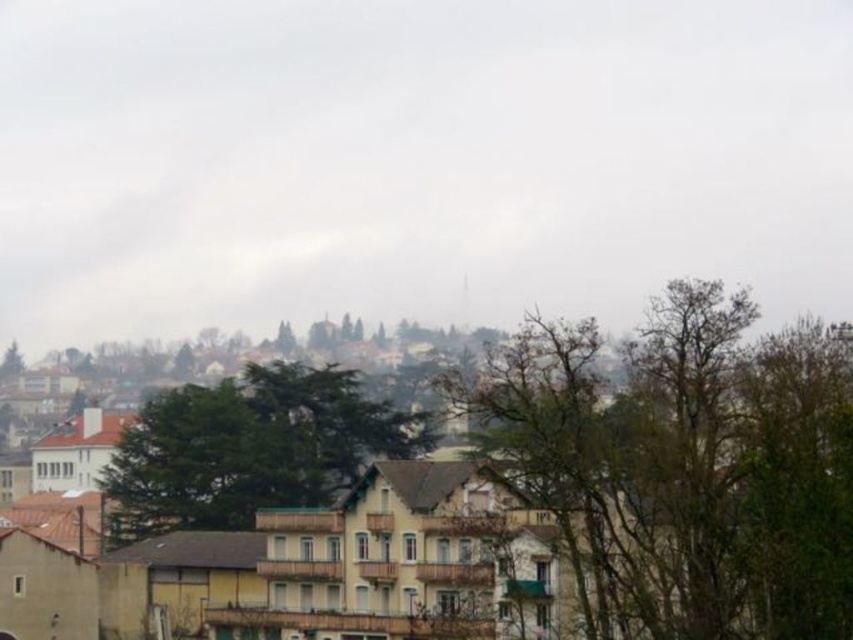
Does yellow matte building at center appear on the left side of brown leafless tree at center?

Indeed, yellow matte building at center is positioned on the left side of brown leafless tree at center.

Who is more forward, [637,340] or [473,385]?

Point [637,340] is in front.

Identify the location of yellow matte building at center. (581, 499).

Does brown leafless tree at center have a greater width compared to green leafy tree at center?

In fact, brown leafless tree at center might be narrower than green leafy tree at center.

Is brown leafless tree at center above green leafy tree at center?

Correct, brown leafless tree at center is located above green leafy tree at center.

The height and width of the screenshot is (640, 853). Describe the element at coordinates (682, 467) in the screenshot. I see `brown leafless tree at center` at that location.

Find the location of a particular element. This screenshot has width=853, height=640. brown leafless tree at center is located at coordinates (682, 467).

Does yellow matte building at center have a greater height compared to green leafy tree at center?

Indeed, yellow matte building at center has a greater height compared to green leafy tree at center.

Locate an element on the screen. yellow matte building at center is located at coordinates (581, 499).